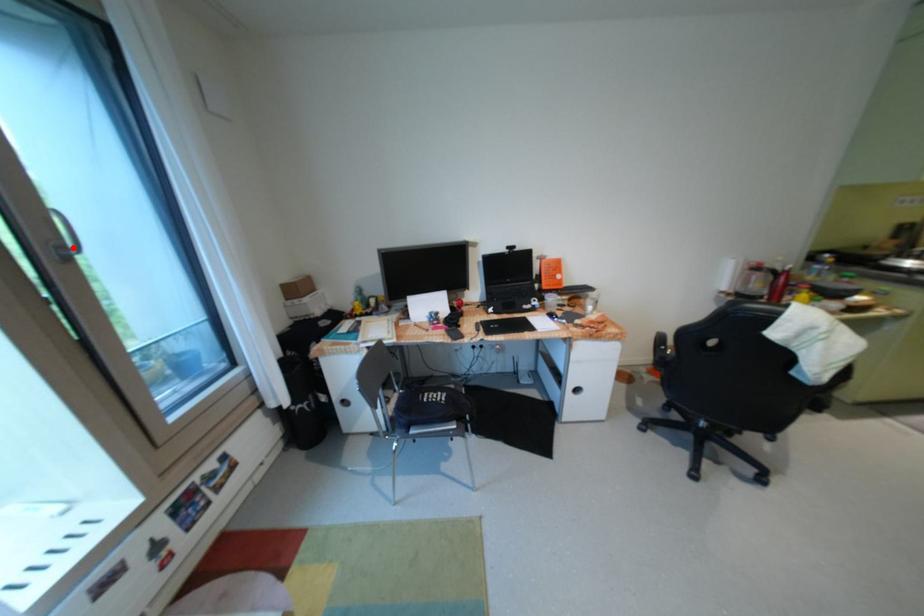
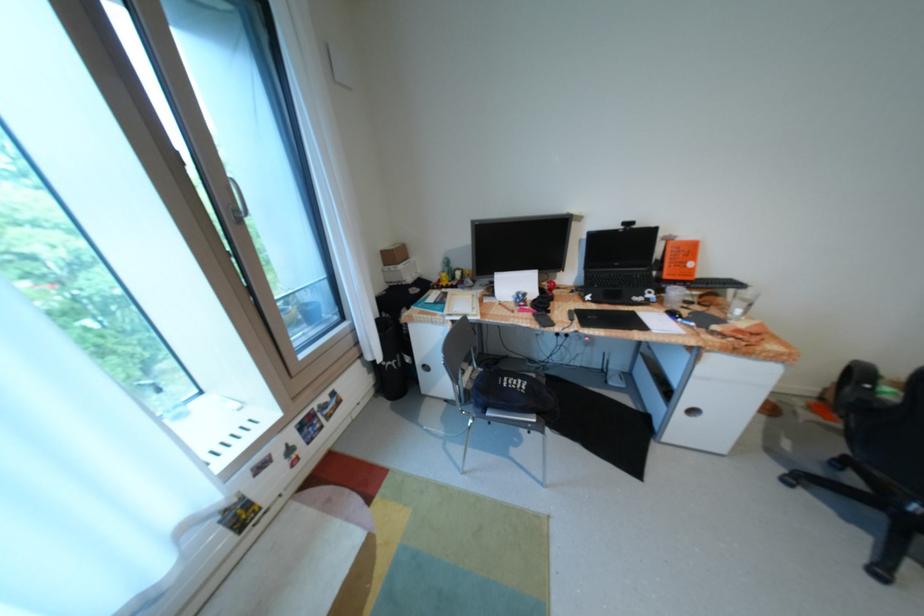
The point at the highlighted location is marked in the first image. Where is the corresponding point in the second image?

(247, 211)